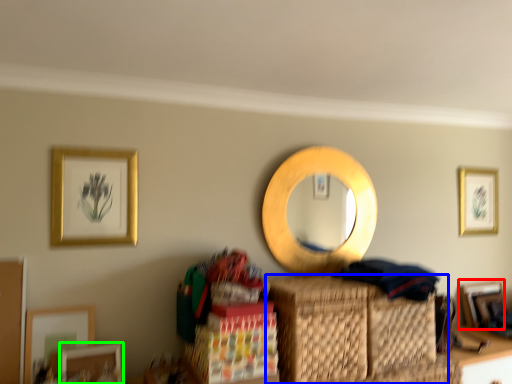
Question: Considering the real-world distances, which object is closest to picture frame (highlighted by a red box)? basket (highlighted by a blue box) or picture frame (highlighted by a green box).

Choices:
 (A) basket
 (B) picture frame

Answer: (A)